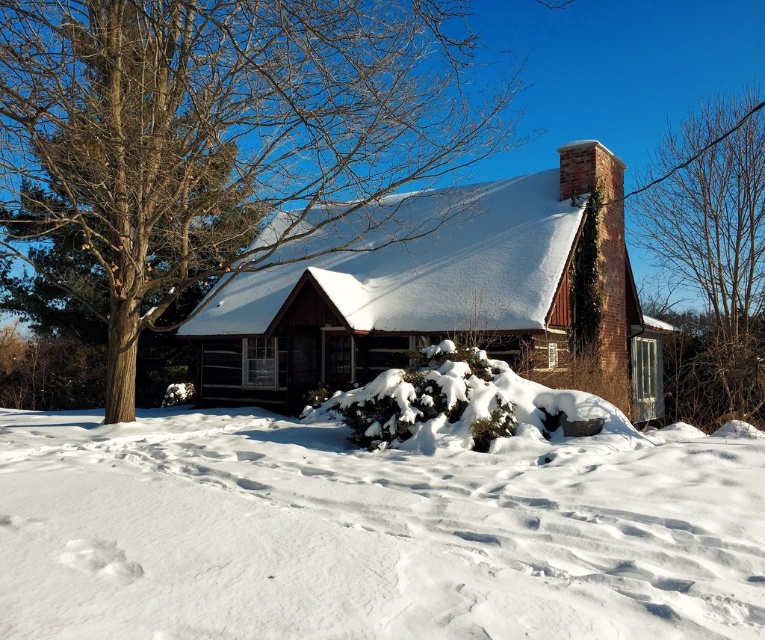
Question: Which point is closer to the camera?

Choices:
 (A) (287, 468)
 (B) (759, 248)
 (C) (246, 365)
 (D) (93, 72)

Answer: (A)

Question: Does brown wood tree at upper left have a greater width compared to brown wooden cabin at center?

Choices:
 (A) no
 (B) yes

Answer: (B)

Question: Is white fluffy snow at lower center below brown wooden cabin at center?

Choices:
 (A) no
 (B) yes

Answer: (B)

Question: Observing the image, what is the correct spatial positioning of brown wood tree at upper left in reference to bare branches at upper right?

Choices:
 (A) below
 (B) above

Answer: (B)

Question: Which point appears closest to the camera in this image?

Choices:
 (A) (314, 307)
 (B) (736, 122)
 (C) (542, 598)

Answer: (C)

Question: Which point appears closest to the camera in this image?

Choices:
 (A) (223, 1)
 (B) (757, 260)

Answer: (A)